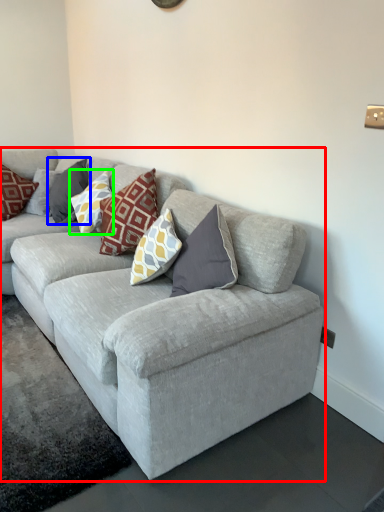
Question: Estimate the real-world distances between objects in this image. Which object is farther from studio couch (highlighted by a red box), pillow (highlighted by a blue box) or pillow (highlighted by a green box)?

Choices:
 (A) pillow
 (B) pillow

Answer: (A)